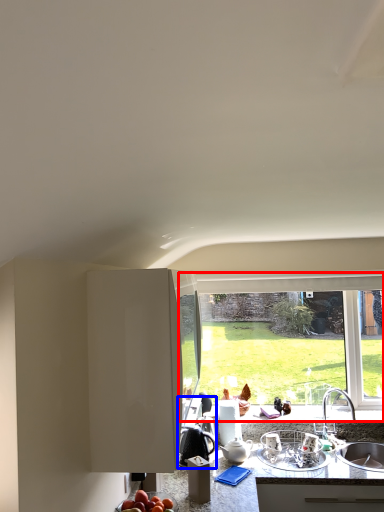
Question: Which point is closer to the camera, window (highlighted by a red box) or appliance (highlighted by a blue box)?

Choices:
 (A) window
 (B) appliance

Answer: (B)